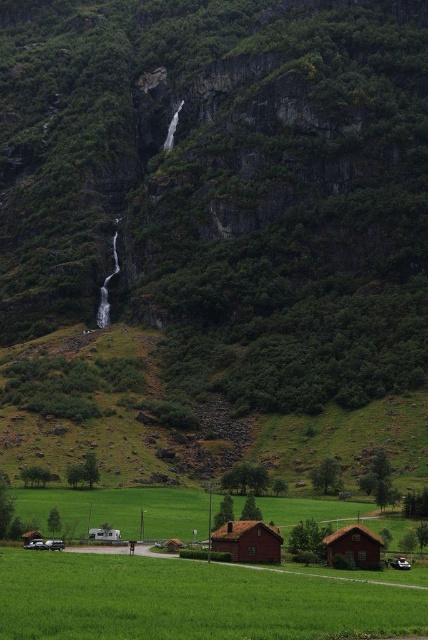
You are standing at the base of the cliff and want to reach the brown wooden hut at lower right. Which direction should you walk relative to the matte red wooden hut at center?

You should walk away from the matte red wooden hut at center towards the brown wooden hut at lower right since the matte red wooden hut is closer to you than the brown wooden hut at lower right.

You are standing at the point marked by the coordinates point (x=192, y=600) in the image. Based on the scene described, what would you most likely see around you?

The point (x=192, y=600) corresponds to the green grass field at lower center, so you would most likely see the green grass field around you.